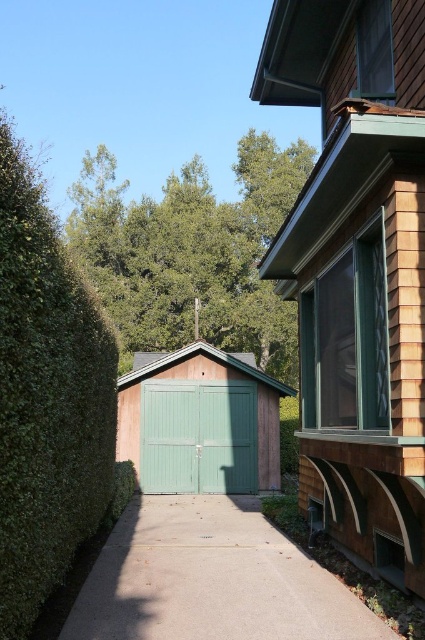
Question: Based on their relative distances, which object is nearer to the green textured shed at center?

Choices:
 (A) green painted wood garage door at center
 (B) smooth concrete driveway at center
 (C) green wood/glass door at center

Answer: (C)

Question: Which point is farther from the camera taking this photo?

Choices:
 (A) (47, 220)
 (B) (124, 412)
 (C) (248, 186)

Answer: (C)

Question: Is green woodshed at center further to camera compared to smooth concrete driveway at center?

Choices:
 (A) no
 (B) yes

Answer: (A)

Question: Can you confirm if green woodshed at center is positioned below green painted wood garage door at center?

Choices:
 (A) no
 (B) yes

Answer: (A)

Question: Is green woodshed at center above green textured shed at center?

Choices:
 (A) yes
 (B) no

Answer: (B)

Question: Which point appears farthest from the camera in this image?

Choices:
 (A) (388, 120)
 (B) (255, 177)

Answer: (B)